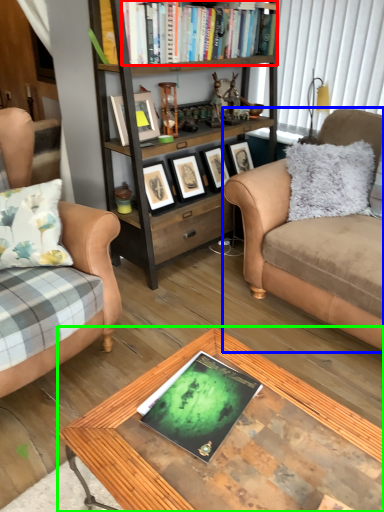
Question: Which is nearer to the book (highlighted by a red box)? studio couch (highlighted by a blue box) or coffee table (highlighted by a green box).

Choices:
 (A) studio couch
 (B) coffee table

Answer: (A)